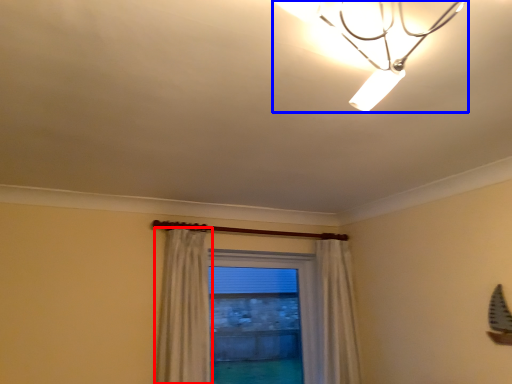
Question: Which of the following is the farthest to the observer, curtain (highlighted by a red box) or lamp (highlighted by a blue box)?

Choices:
 (A) curtain
 (B) lamp

Answer: (A)